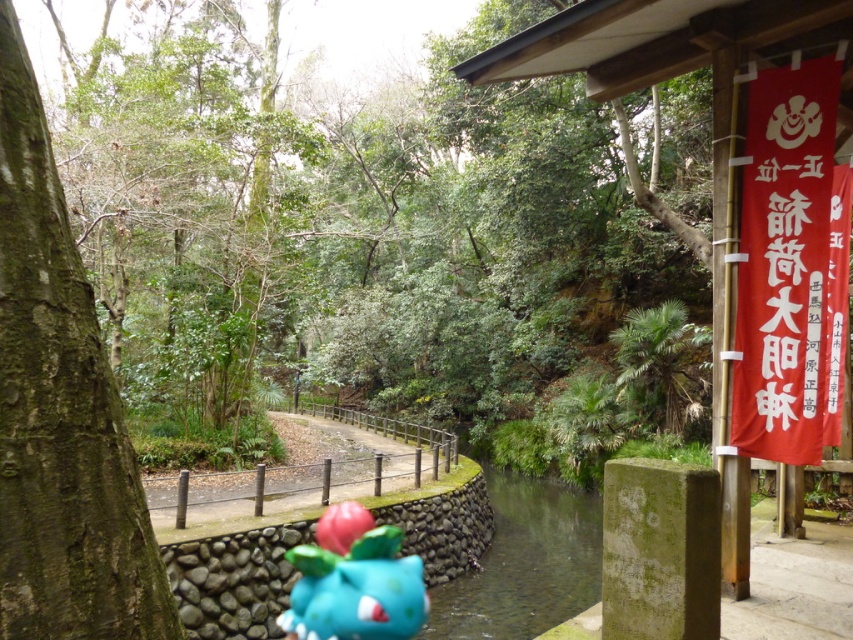
You are standing at the center of the image and want to walk towards the rough bark tree at left. Which direction should you face to move directly towards it?

The rough bark tree at left is located at point (61, 410), so you should face towards the left side of the image to move directly towards it.

You are a hiker who wants to place a 2 meter long backpack between the rough bark tree at left and the shiny blue plastic toy at center. Is there enough space to place it without moving either object?

The distance between the rough bark tree at left and the shiny blue plastic toy at center is 6.04 meters, so yes, there is enough space to place a 2 meter long backpack between them without moving either object.